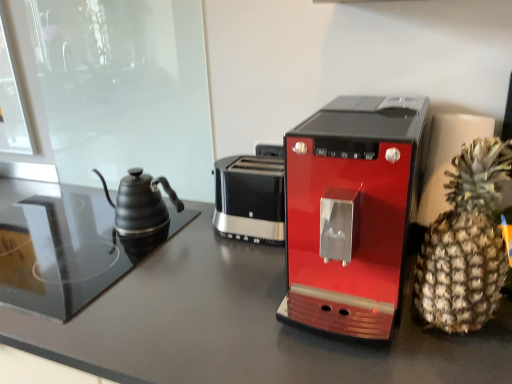
You are a GUI agent. You are given a task and a screenshot of the screen. Output one action in this format:
    pyautogui.click(x=<x>, y=<y>)
    Task: Click on the blank space to the left of black plastic toaster at center
    This screenshot has width=512, height=384.
    Given the screenshot: What is the action you would take?
    pyautogui.click(x=191, y=237)